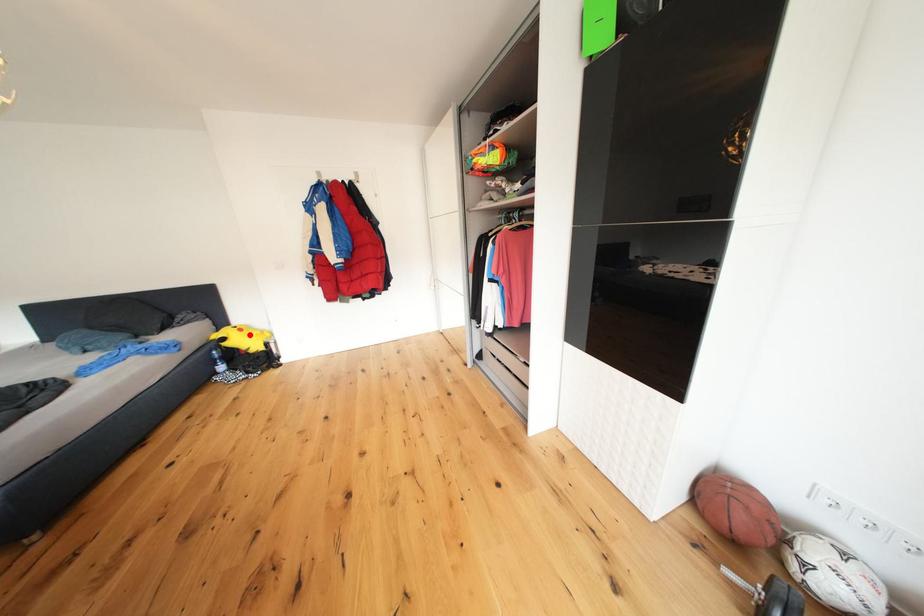
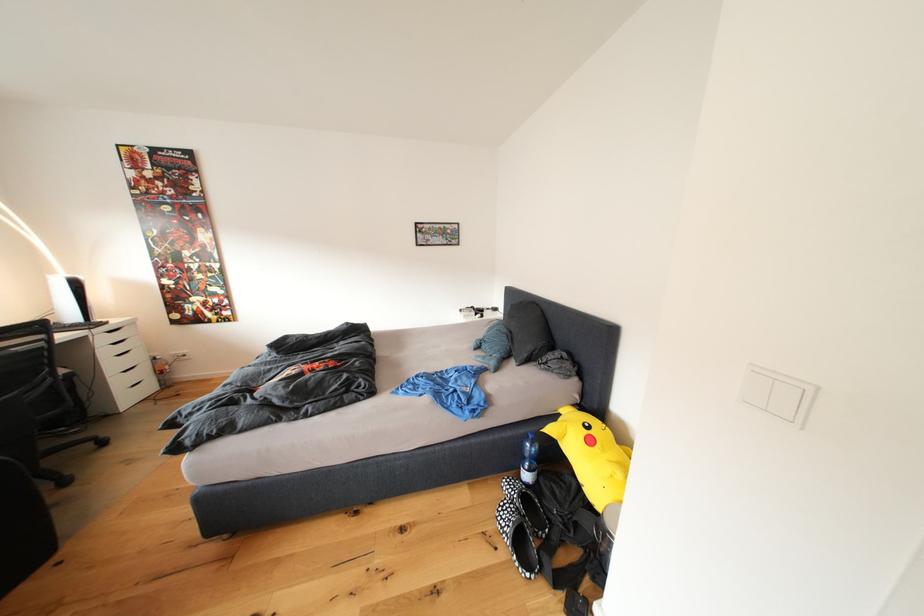
Question: A red point is marked in image1. In image2, is the corresponding 3D point closer to the camera or farther? Reply with the corresponding letter.

Choices:
 (A) The corresponding 3D point is closer.
 (B) The corresponding 3D point is farther.

Answer: (B)